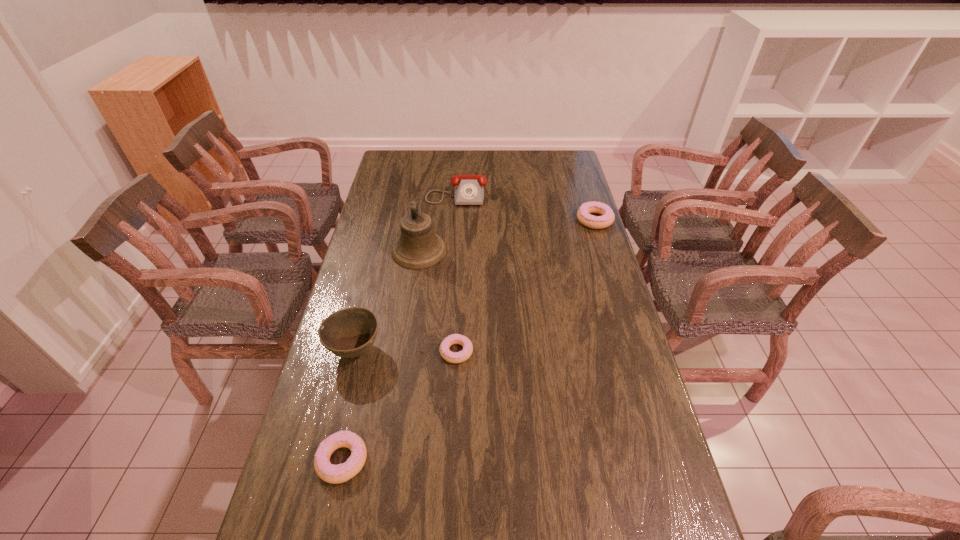
This screenshot has height=540, width=960. Identify the location of the second tallest doughnut. (335, 474).

This screenshot has width=960, height=540. I want to click on the fifth tallest object, so click(x=335, y=474).

At what (x,y) coordinates should I click in order to perform the action: click on the shortest doughnut. Please return your answer as a coordinate pair (x, y). Looking at the image, I should click on (458, 357).

Where is `the second nearest doughnut`? the second nearest doughnut is located at coordinates (458, 357).

Where is `the rightmost doughnut`? This screenshot has height=540, width=960. the rightmost doughnut is located at coordinates coord(583,214).

Find the location of a particular element. the tallest doughnut is located at coordinates (583, 214).

What are the coordinates of `the fourth nearest object` in the screenshot? It's located at (418, 247).

This screenshot has width=960, height=540. In order to click on bell in this screenshot , I will do `click(418, 247)`.

Find the location of a particular element. This screenshot has height=540, width=960. the third tallest object is located at coordinates (469, 189).

This screenshot has height=540, width=960. Identify the location of the farthest object. (469, 189).